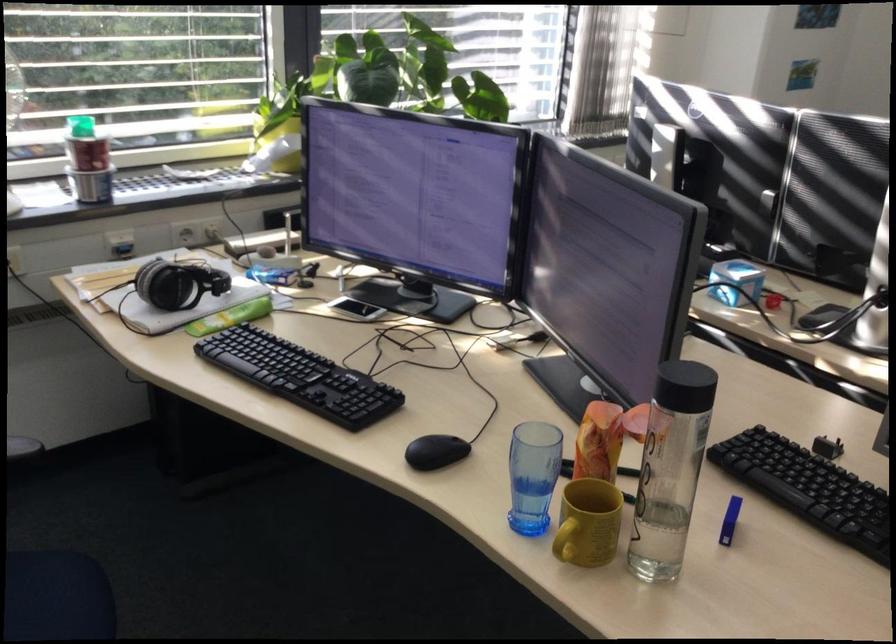
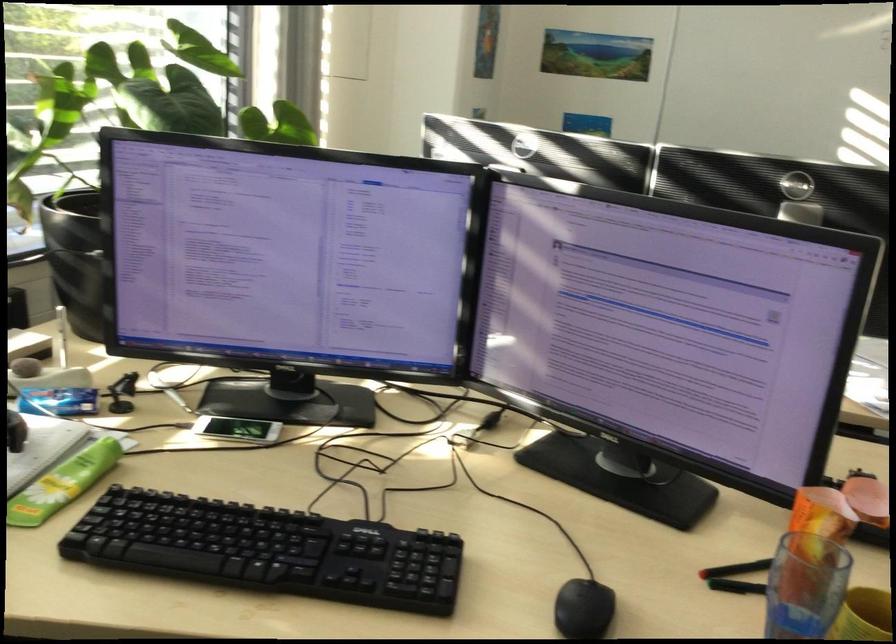
The point at [428,448] is marked in the first image. Where is the corresponding point in the second image?

(583, 609)